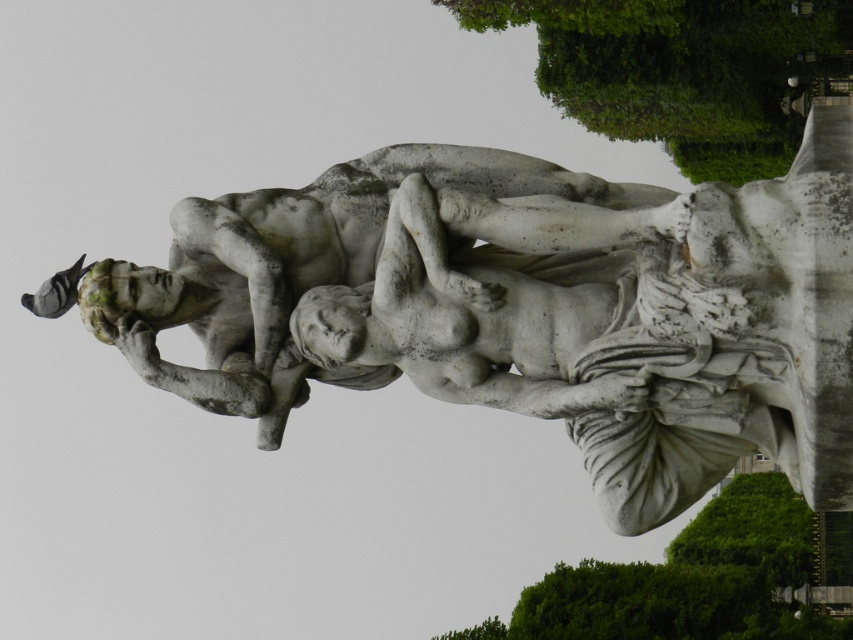
Question: Which of the following is the closest to the observer?

Choices:
 (A) green leafy tree at upper right
 (B) white marble statue at center

Answer: (B)

Question: Which of the following is the closest to the observer?

Choices:
 (A) (486, 634)
 (B) (112, 260)
 (C) (665, 52)

Answer: (B)

Question: Does white marble statue at center appear on the right side of green leafy tree at lower right?

Choices:
 (A) yes
 (B) no

Answer: (B)

Question: Can you confirm if white marble statue at center is thinner than green leafy tree at upper right?

Choices:
 (A) yes
 (B) no

Answer: (A)

Question: Observing the image, what is the correct spatial positioning of white marble statue at center in reference to green leafy tree at lower right?

Choices:
 (A) below
 (B) above

Answer: (B)

Question: Among these points, which one is nearest to the camera?

Choices:
 (A) (467, 632)
 (B) (711, 58)
 (C) (676, 227)

Answer: (C)